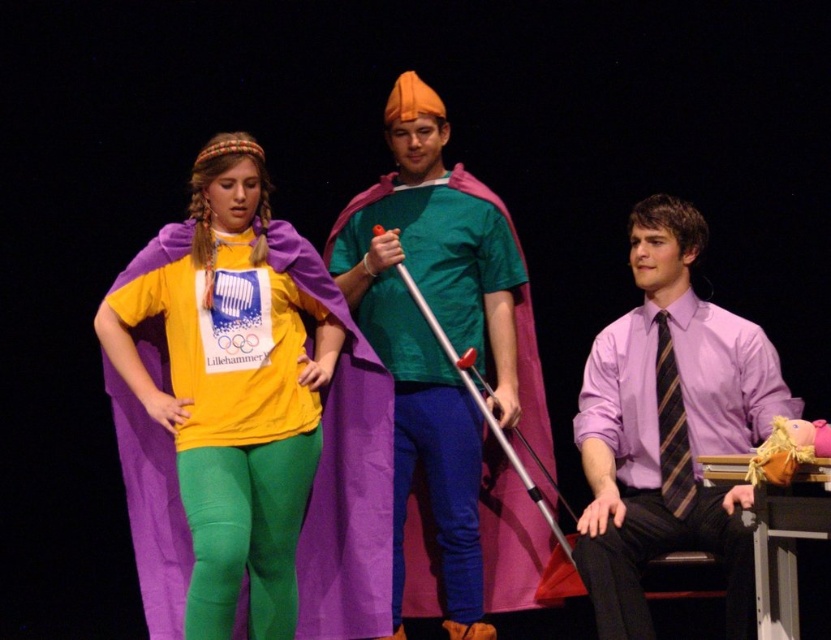
You are a costume designer working on a play and need to ensure that the purple silk shirt at right and the striped silk tie at right are positioned correctly. Given that the minimum required distance between them for proper visibility is 15 centimeters, can you confirm if their current positioning meets this requirement?

The purple silk shirt at right and the striped silk tie at right are 16.89 centimeters apart from each other, which exceeds the minimum required distance of 15 centimeters. Therefore, their current positioning meets the requirement for proper visibility.